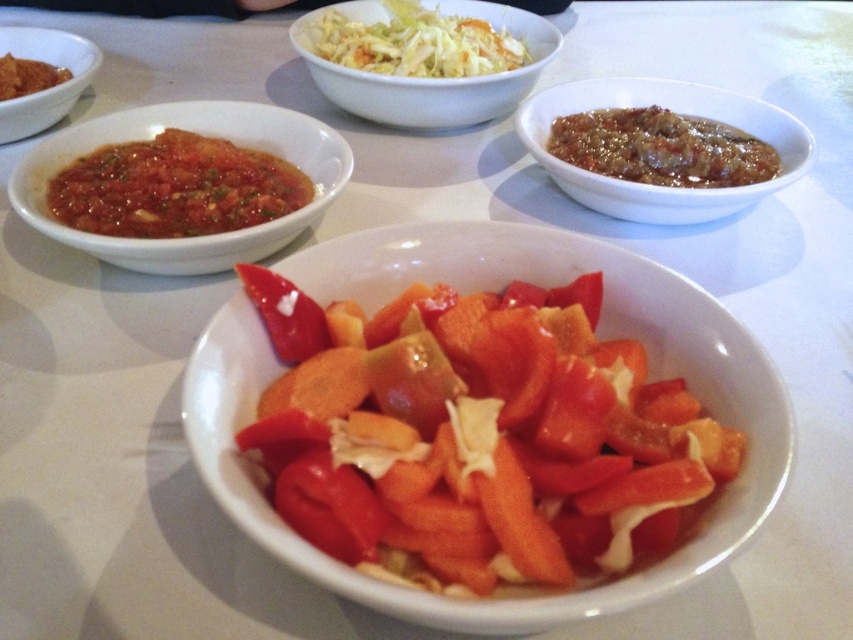
Measure the distance between slightly glossy ceramic bowl at center and matte brown sauce at upper left.

A distance of 1.13 meters exists between slightly glossy ceramic bowl at center and matte brown sauce at upper left.

Based on the photo, between slightly glossy ceramic bowl at center and matte brown sauce at upper left, which one appears on the left side from the viewer's perspective?

matte brown sauce at upper left

Based on the photo, who is more distant from viewer, (479, 611) or (39, 90)?

Positioned behind is point (39, 90).

Identify the location of slightly glossy ceramic bowl at center. The width and height of the screenshot is (853, 640). (494, 291).

Can you confirm if white glossy bowl at upper center is bigger than matte red sauce at upper left?

Yes, white glossy bowl at upper center is bigger than matte red sauce at upper left.

Which is more to the left, white glossy bowl at upper center or matte red sauce at upper left?

Positioned to the left is matte red sauce at upper left.

I want to click on white glossy bowl at upper center, so click(x=431, y=77).

The width and height of the screenshot is (853, 640). I want to click on white glossy bowl at upper center, so click(x=431, y=77).

From the picture: Does slightly glossy brown sauce at upper right lie behind white glossy bowl at upper center?

No, slightly glossy brown sauce at upper right is closer to the viewer.

Which is below, slightly glossy brown sauce at upper right or white glossy bowl at upper center?

slightly glossy brown sauce at upper right

The height and width of the screenshot is (640, 853). Describe the element at coordinates (679, 113) in the screenshot. I see `slightly glossy brown sauce at upper right` at that location.

Locate an element on the screen. Image resolution: width=853 pixels, height=640 pixels. slightly glossy brown sauce at upper right is located at coordinates (679, 113).